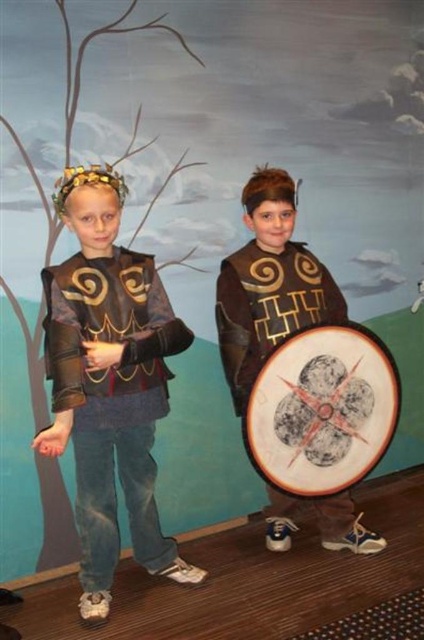
Does matte black armor at left have a smaller size compared to wooden shield at right?

Actually, matte black armor at left might be larger than wooden shield at right.

Which is more to the right, matte black armor at left or wooden shield at right?

wooden shield at right

Where is `matte black armor at left`? This screenshot has width=424, height=640. matte black armor at left is located at coordinates (108, 381).

Is wooden shield at right further to camera compared to brown leather shield at center?

That is False.

Between point (356, 465) and point (250, 262), which one is positioned in front?

Positioned in front is point (356, 465).

Locate an element on the screen. The image size is (424, 640). wooden shield at right is located at coordinates (323, 410).

Does matte black armor at left appear under brown leather shield at center?

Correct, matte black armor at left is located below brown leather shield at center.

Does matte black armor at left have a lesser height compared to brown leather shield at center?

In fact, matte black armor at left may be taller than brown leather shield at center.

Is point (94, 512) closer to viewer compared to point (351, 531)?

Yes.

This screenshot has height=640, width=424. Find the location of `matte black armor at left`. matte black armor at left is located at coordinates (108, 381).